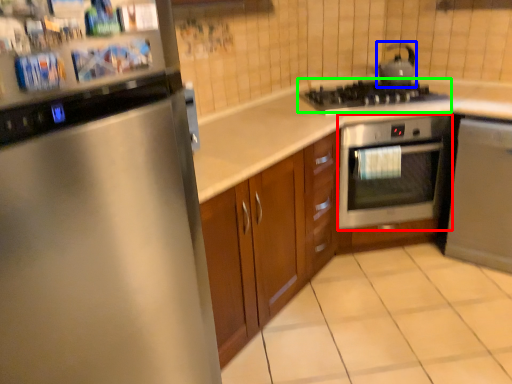
Question: Which is nearer to the oven (highlighted by a red box)? tea pot (highlighted by a blue box) or gas stove (highlighted by a green box).

Choices:
 (A) tea pot
 (B) gas stove

Answer: (B)